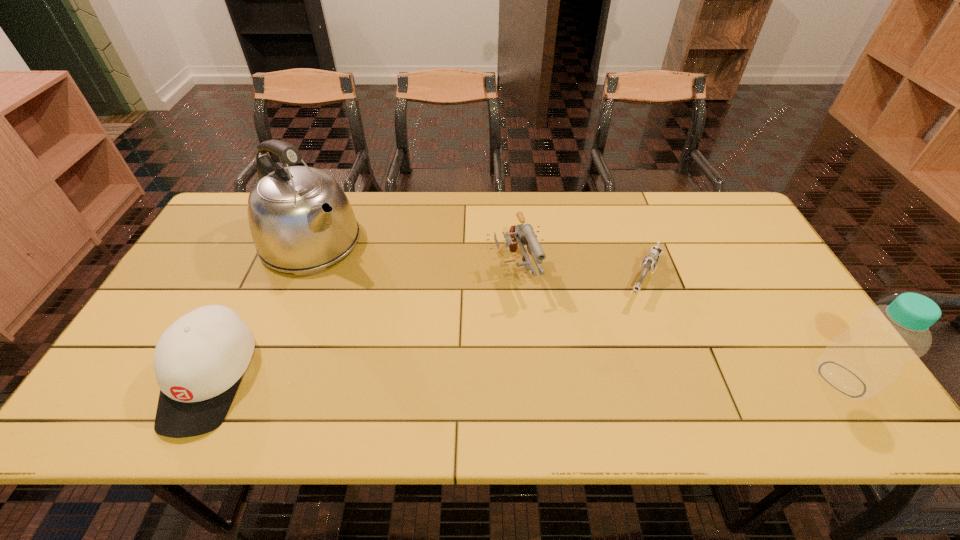
Image resolution: width=960 pixels, height=540 pixels. I want to click on free space on the desktop that is between the baseball cap and the rightmost object and is positioned at the barrel end of the third object from left to right, so click(560, 379).

You are a GUI agent. You are given a task and a screenshot of the screen. Output one action in this format:
    pyautogui.click(x=<x>, y=<y>)
    Task: Click on the vacant space on the desktop that is between the second shortest object and the fourth shortest object and is positioned aimed along the barrel of the shorter gun
    The width and height of the screenshot is (960, 540).
    Given the screenshot: What is the action you would take?
    pos(594,379)

Where is `vacant space on the desktop that is between the second shortest object and the bottle and is positioned on the spout of the kettle`? This screenshot has height=540, width=960. vacant space on the desktop that is between the second shortest object and the bottle and is positioned on the spout of the kettle is located at coordinates (468, 379).